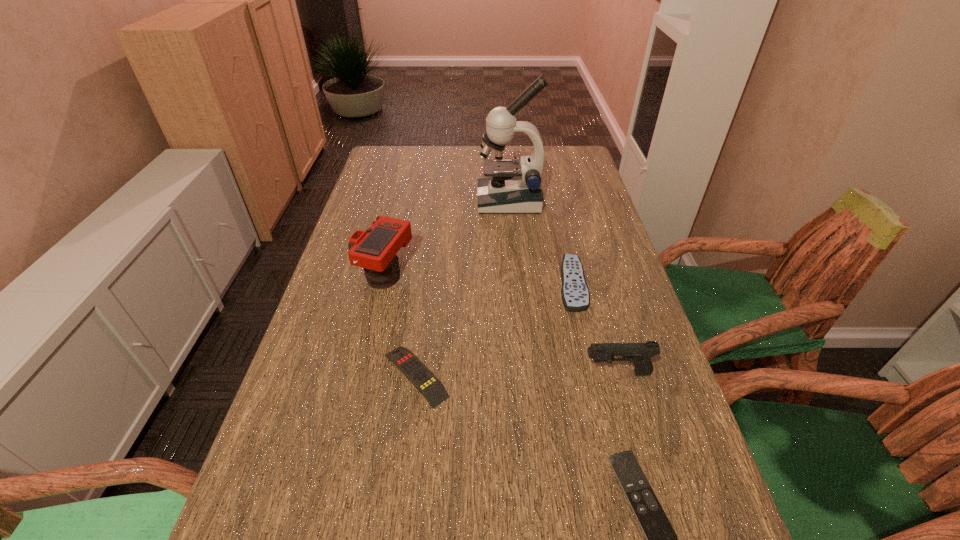
Image resolution: width=960 pixels, height=540 pixels. In order to click on free spot between the leftmost remote control and the farthest remote control in this screenshot , I will do `click(493, 330)`.

At what (x,y) coordinates should I click in order to perform the action: click on unoccupied area between the leftmost remote control and the pistol. Please return your answer as a coordinate pair (x, y). Looking at the image, I should click on (516, 374).

The image size is (960, 540). Find the location of `object identified as the fourth closest to the second tallest object`. object identified as the fourth closest to the second tallest object is located at coordinates (640, 354).

This screenshot has width=960, height=540. Identify the location of object that is the second closest to the microscope. (375, 249).

Identify which remote control is the closest to the nearest remote control. Please provide its 2D coordinates. Your answer should be formatted as a tuple, i.e. [(x, y)], where the tuple contains the x and y coordinates of a point satisfying the conditions above.

[(425, 382)]

Identify the location of the second closest remote control to the leftmost remote control. The height and width of the screenshot is (540, 960). (661, 539).

At what (x,y) coordinates should I click in order to perform the action: click on free location that satisfies the following two spatial constraints: 1. on the back side of the second tallest object; 2. on the left side of the tallest object. Please return your answer as a coordinate pair (x, y). Looking at the image, I should click on (402, 201).